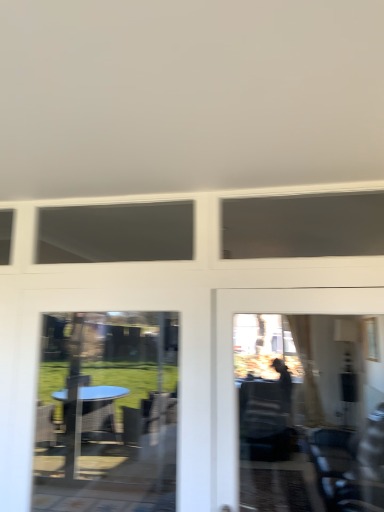
This screenshot has height=512, width=384. I want to click on transparent glass table at lower left, so click(x=107, y=412).

Image resolution: width=384 pixels, height=512 pixels. What do you see at coordinates (107, 412) in the screenshot?
I see `transparent glass table at lower left` at bounding box center [107, 412].

Identify the location of matte glass door at right. Image resolution: width=384 pixels, height=512 pixels. (232, 360).

The height and width of the screenshot is (512, 384). Describe the element at coordinates (232, 360) in the screenshot. I see `matte glass door at right` at that location.

Locate an element on the screen. transparent glass table at lower left is located at coordinates (107, 412).

Consider the image. Considering the positions of objects matte glass door at right and transparent glass table at lower left in the image provided, who is more to the left, matte glass door at right or transparent glass table at lower left?

transparent glass table at lower left is more to the left.

Is matte glass door at right in front of or behind transparent glass table at lower left in the image?

Clearly, matte glass door at right is in front of transparent glass table at lower left.

Which is in front, point (276, 303) or point (56, 426)?

The point (276, 303) is more forward.

From the image's perspective, between matte glass door at right and transparent glass table at lower left, which one is located above?

matte glass door at right.

From a real-world perspective, is matte glass door at right located higher than transparent glass table at lower left?

Indeed, from a real-world perspective, matte glass door at right stands above transparent glass table at lower left.

Is matte glass door at right thinner than transparent glass table at lower left?

In fact, matte glass door at right might be wider than transparent glass table at lower left.

Considering the sizes of matte glass door at right and transparent glass table at lower left in the image, is matte glass door at right taller or shorter than transparent glass table at lower left?

matte glass door at right is shorter than transparent glass table at lower left.

Based on their sizes in the image, would you say matte glass door at right is bigger or smaller than transparent glass table at lower left?

In the image, matte glass door at right appears to be larger than transparent glass table at lower left.

Would you say matte glass door at right is outside transparent glass table at lower left?

matte glass door at right is positioned outside transparent glass table at lower left.

Is matte glass door at right far from transparent glass table at lower left?

Indeed, matte glass door at right is not near transparent glass table at lower left.

Is matte glass door at right facing towards transparent glass table at lower left?

No, matte glass door at right is not facing towards transparent glass table at lower left.

Locate an element on the screen. garage door positioned vertically above the transparent glass table at lower left (from a real-world perspective) is located at coordinates (232, 360).

Based on their positions, is transparent glass table at lower left located to the left or right of matte glass door at right?

transparent glass table at lower left is to the left of matte glass door at right.

Looking at this image, which object is further away from the camera, transparent glass table at lower left or matte glass door at right?

transparent glass table at lower left.

Is point (81, 485) positioned in front of point (275, 294)?

No, it is not.

From the image's perspective, is transparent glass table at lower left above or below matte glass door at right?

Based on their image positions, transparent glass table at lower left is located beneath matte glass door at right.

From a real-world perspective, is transparent glass table at lower left below matte glass door at right?

Yes, from a real-world perspective, transparent glass table at lower left is under matte glass door at right.

Considering the sizes of objects transparent glass table at lower left and matte glass door at right in the image provided, who is thinner, transparent glass table at lower left or matte glass door at right?

With smaller width is transparent glass table at lower left.

Which of these two, transparent glass table at lower left or matte glass door at right, stands taller?

With more height is transparent glass table at lower left.

Looking at the image, does transparent glass table at lower left seem bigger or smaller compared to matte glass door at right?

Considering their sizes, transparent glass table at lower left takes up less space than matte glass door at right.

Which is correct: transparent glass table at lower left is inside matte glass door at right, or outside of it?

transparent glass table at lower left is outside matte glass door at right.

Is transparent glass table at lower left directly adjacent to matte glass door at right?

No, transparent glass table at lower left is not beside matte glass door at right.

Is transparent glass table at lower left facing towards matte glass door at right?

No.

How many degrees apart are the facing directions of transparent glass table at lower left and matte glass door at right?

They differ by 1.22 degrees in their facing directions.

Measure the distance between transparent glass table at lower left and matte glass door at right.

transparent glass table at lower left is 2.85 meters from matte glass door at right.

In the image, there is a transparent glass table at lower left. Where is `garage door above it (from the image's perspective)`? Image resolution: width=384 pixels, height=512 pixels. garage door above it (from the image's perspective) is located at coordinates (232, 360).

Identify the location of garage door above the transparent glass table at lower left (from a real-world perspective). The height and width of the screenshot is (512, 384). coord(232,360).

You are a GUI agent. You are given a task and a screenshot of the screen. Output one action in this format:
    pyautogui.click(x=<x>, y=<y>)
    Task: Click on the garage door that appears on the right of transparent glass table at lower left
    This screenshot has height=512, width=384.
    Given the screenshot: What is the action you would take?
    pyautogui.click(x=232, y=360)